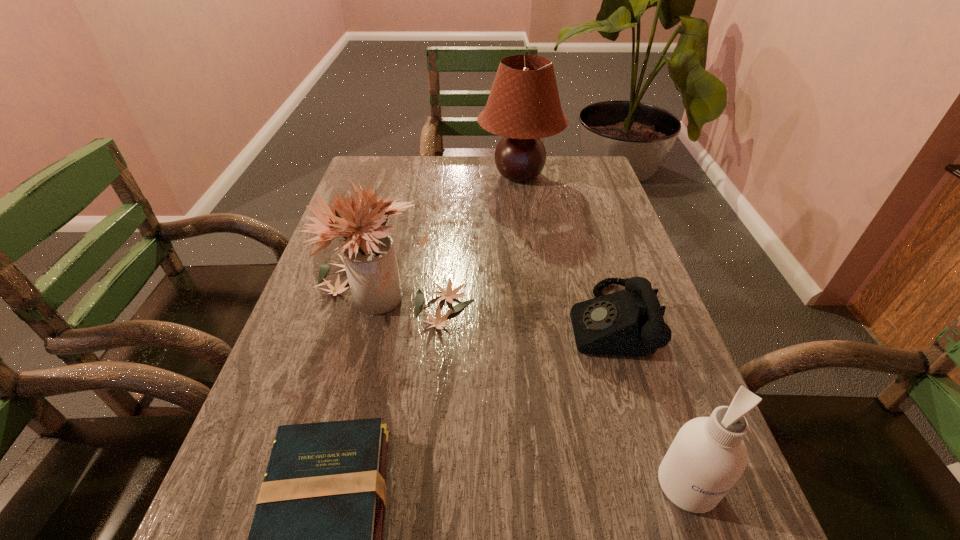
Locate an element on the screen. The height and width of the screenshot is (540, 960). vacant space situated on the dial of the fourth tallest object is located at coordinates (510, 322).

I want to click on vacant point located 0.230m on the dial of the fourth tallest object, so click(471, 322).

This screenshot has width=960, height=540. In order to click on object present at the far edge in this screenshot , I will do `click(523, 106)`.

Identify the location of object that is at the left edge. The height and width of the screenshot is (540, 960). (369, 256).

The width and height of the screenshot is (960, 540). I want to click on lampshade at the right edge, so click(523, 106).

Locate an element on the screen. cleansing agent present at the right edge is located at coordinates (708, 455).

Locate an element on the screen. telephone that is positioned at the right edge is located at coordinates (630, 322).

In order to click on object that is at the far right corner in this screenshot , I will do 523,106.

This screenshot has width=960, height=540. In order to click on vacant space at the far edge of the desktop in this screenshot , I will do `click(483, 159)`.

This screenshot has width=960, height=540. Find the location of `blank space at the left edge of the desktop`. blank space at the left edge of the desktop is located at coordinates (391, 198).